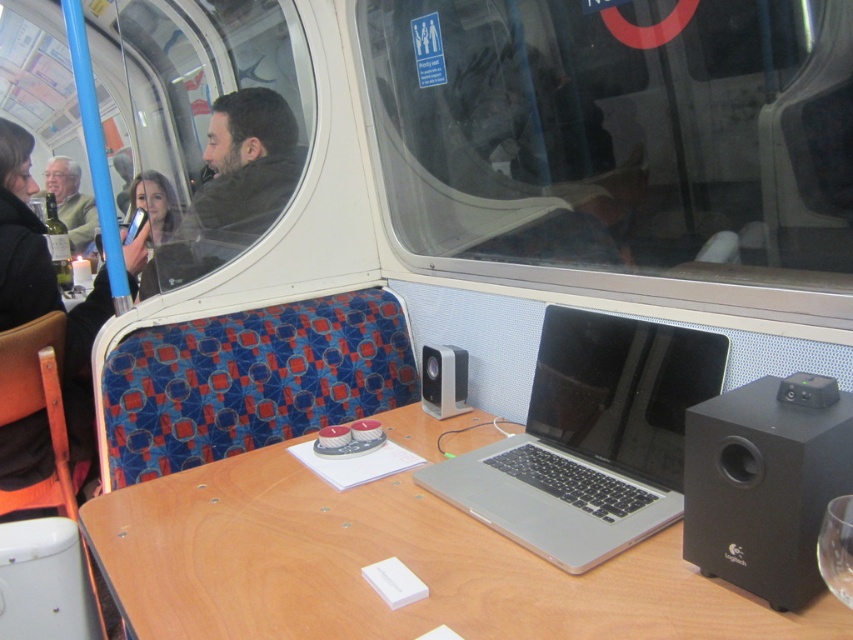
Does satin silver speaker at upper center have a larger size compared to matte black jacket at upper left?

Actually, satin silver speaker at upper center might be smaller than matte black jacket at upper left.

Can you confirm if satin silver speaker at upper center is positioned to the left of matte black jacket at upper left?

Incorrect, satin silver speaker at upper center is not on the left side of matte black jacket at upper left.

Which is behind, point (424, 346) or point (86, 202)?

Point (86, 202)

In order to click on satin silver speaker at upper center in this screenshot , I will do `click(444, 380)`.

Is transparent glass at lower right wider than matte black jacket at upper left?

In fact, transparent glass at lower right might be narrower than matte black jacket at upper left.

Between transparent glass at lower right and matte black jacket at upper left, which one appears on the left side from the viewer's perspective?

matte black jacket at upper left is more to the left.

The image size is (853, 640). Find the location of `transparent glass at lower right`. transparent glass at lower right is located at coordinates (836, 548).

Does black plastic speaker at lower right have a lesser width compared to transparent glass at lower right?

In fact, black plastic speaker at lower right might be wider than transparent glass at lower right.

Between point (770, 452) and point (844, 531), which one is positioned in front?

Point (844, 531) is in front.

This screenshot has width=853, height=640. I want to click on black plastic speaker at lower right, so click(x=764, y=483).